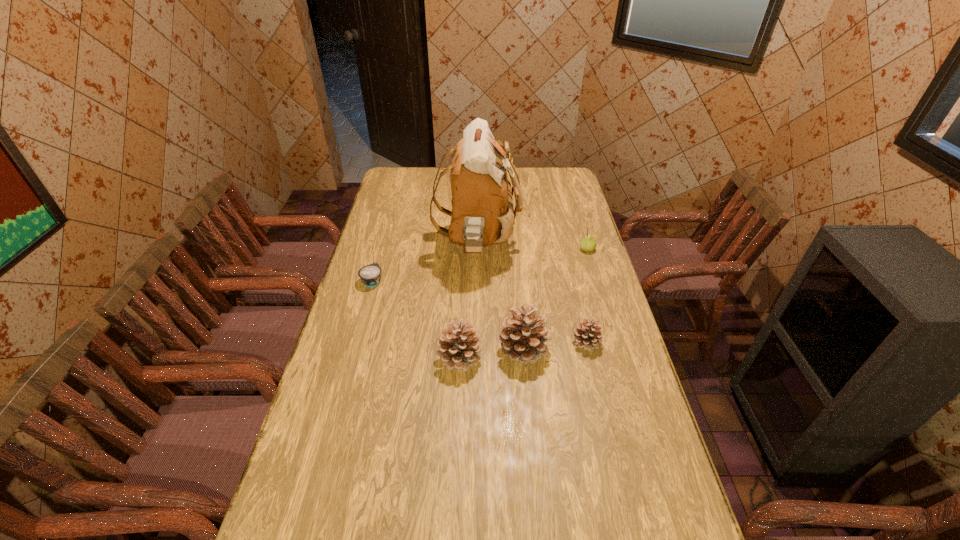
The width and height of the screenshot is (960, 540). In order to click on vacant region that satisfies the following two spatial constraints: 1. on the front-facing side of the backpack; 2. on the front side of the third tallest object in this screenshot , I will do `click(477, 358)`.

Identify the location of free location that satisfies the following two spatial constraints: 1. on the front-facing side of the backpack; 2. on the right side of the second object from right to left. Image resolution: width=960 pixels, height=540 pixels. coord(477,342).

Where is `free space that satisfies the following two spatial constraints: 1. on the front side of the shortest object; 2. on the right side of the leftmost pinecone`? free space that satisfies the following two spatial constraints: 1. on the front side of the shortest object; 2. on the right side of the leftmost pinecone is located at coordinates (350, 358).

Where is `vacant area that satisfies the following two spatial constraints: 1. on the front-facing side of the tallest object; 2. on the front side of the second tallest pinecone`? The width and height of the screenshot is (960, 540). vacant area that satisfies the following two spatial constraints: 1. on the front-facing side of the tallest object; 2. on the front side of the second tallest pinecone is located at coordinates (477, 358).

You are a GUI agent. You are given a task and a screenshot of the screen. Output one action in this format:
    pyautogui.click(x=<x>, y=<y>)
    Task: Click on the vacant region that satisfies the following two spatial constraints: 1. on the front side of the shortest object; 2. on the right side of the rightmost pinecone
    This screenshot has height=540, width=960.
    Given the screenshot: What is the action you would take?
    pyautogui.click(x=355, y=342)